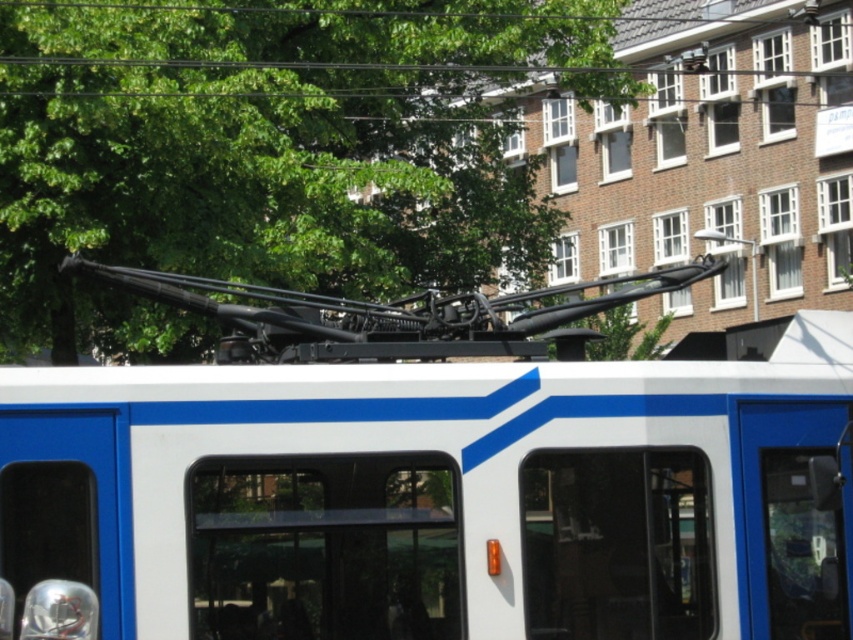
Question: Is white matte train at center to the right of green leafy tree at upper center from the viewer's perspective?

Choices:
 (A) yes
 (B) no

Answer: (B)

Question: Is white matte train at center wider than green leafy tree at upper center?

Choices:
 (A) no
 (B) yes

Answer: (A)

Question: Can you confirm if white matte train at center is bigger than green leafy tree at upper center?

Choices:
 (A) no
 (B) yes

Answer: (A)

Question: Which of the following is the closest to the observer?

Choices:
 (A) (16, 282)
 (B) (403, 547)

Answer: (B)

Question: Which point is farther to the camera?

Choices:
 (A) green leafy tree at upper center
 (B) white matte train at center

Answer: (A)